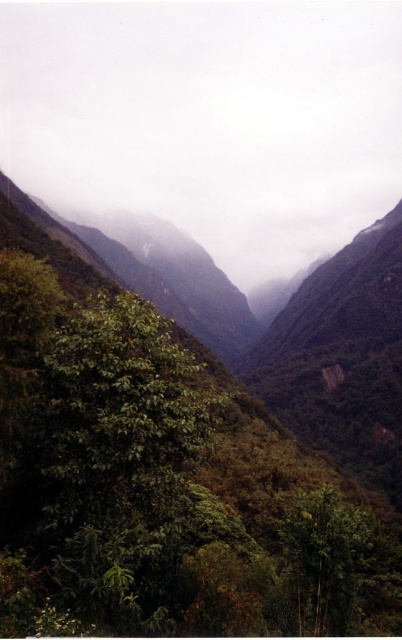
Can you confirm if green matte cloud at center is positioned below green leafy tree at center?

No.

What do you see at coordinates (209, 120) in the screenshot?
I see `green matte cloud at center` at bounding box center [209, 120].

Measure the distance between green matte cloud at center and camera.

1463.11 feet

You are a GUI agent. You are given a task and a screenshot of the screen. Output one action in this format:
    pyautogui.click(x=<x>, y=<y>)
    Task: Click on the green matte cloud at center
    Image resolution: width=402 pixels, height=640 pixels.
    Given the screenshot: What is the action you would take?
    pyautogui.click(x=209, y=120)

Can you confirm if green matte cloud at center is smaller than green matte tree at lower right?

→ No.

Which is more to the left, green matte cloud at center or green matte tree at lower right?

green matte cloud at center

Locate an element on the screen. Image resolution: width=402 pixels, height=640 pixels. green matte cloud at center is located at coordinates (209, 120).

Who is higher up, green leafy tree at center or green matte tree at lower right?

green leafy tree at center is above.

What do you see at coordinates (118, 461) in the screenshot?
I see `green leafy tree at center` at bounding box center [118, 461].

Locate an element on the screen. green leafy tree at center is located at coordinates (118, 461).